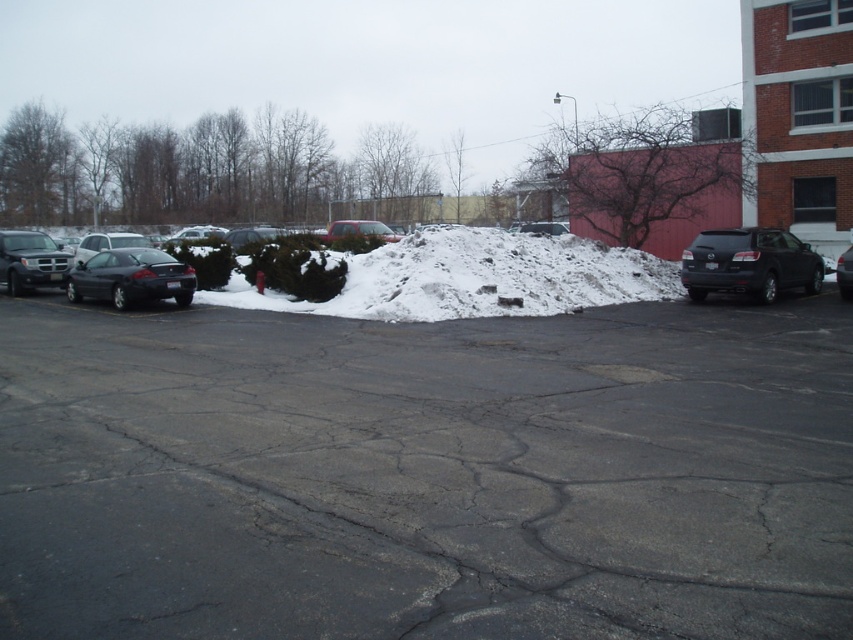
You are a delivery person trying to park your van in the parking lot. You see the shiny black sedan at left and the shiny silver sedan at left. Which one is closer to the ground?

The shiny black sedan at left is below the shiny silver sedan at left, so the shiny black sedan at left is closer to the ground.

You are a delivery person trying to park a new car that is 1.8 meters wide in the parking lot. You see the shiny black sedan at left and the shiny silver sedan at left. Which car has a narrower width that might allow your new car to fit in the same parking space?

The shiny black sedan at left has a lesser width compared to the shiny silver sedan at left, so the shiny black sedan at left is narrower and your new car might fit in its parking space.